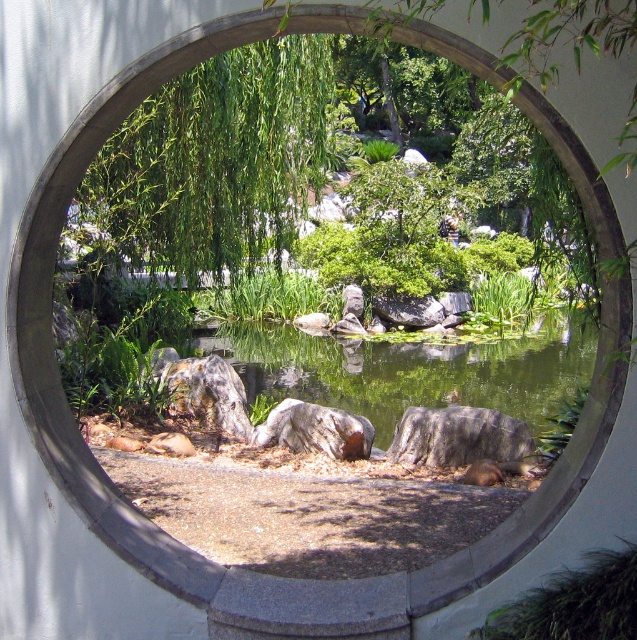
Does green leafy tree at upper left have a larger size compared to gray rough rock at center?

Correct, green leafy tree at upper left is larger in size than gray rough rock at center.

Does green leafy tree at upper left have a lesser height compared to gray rough rock at center?

Incorrect, green leafy tree at upper left's height does not fall short of gray rough rock at center's.

Is point (187, 145) positioned after point (473, 440)?

Yes, it is.

Locate an element on the screen. green leafy tree at upper left is located at coordinates (217, 161).